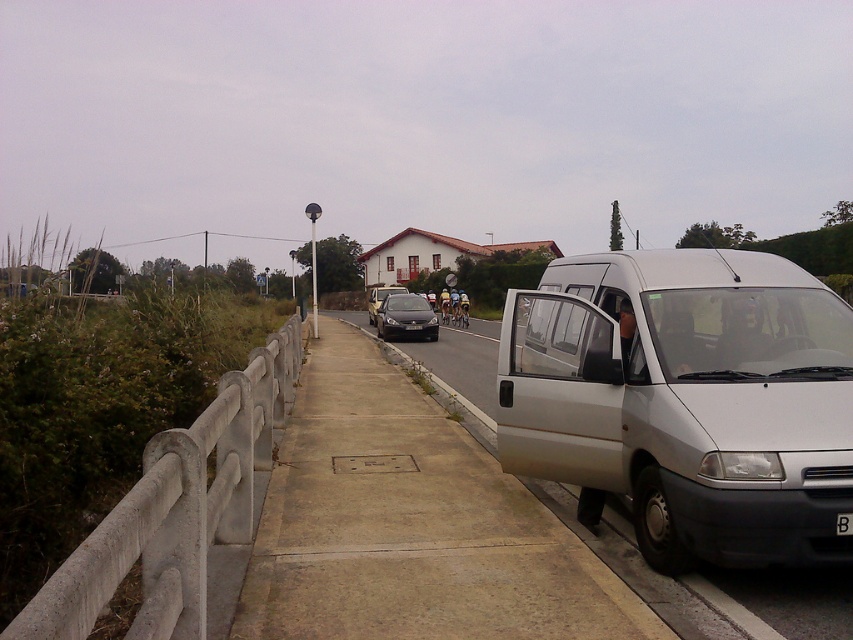
Question: Which point is farther from the camera taking this photo?

Choices:
 (A) [541, 348]
 (B) [380, 326]
 (C) [381, 307]
 (D) [849, 518]

Answer: (C)

Question: Does concrete at left lie behind satin black sedan at center?

Choices:
 (A) yes
 (B) no

Answer: (B)

Question: Is satin silver van at center wider than black plastic license plate at center?

Choices:
 (A) no
 (B) yes

Answer: (B)

Question: Can you confirm if white metallic van at right is positioned to the left of satin black sedan at center?

Choices:
 (A) no
 (B) yes

Answer: (A)

Question: Which object is farther from the camera taking this photo?

Choices:
 (A) concrete at left
 (B) satin silver van at center
 (C) white metallic van at right
 (D) black plastic license plate at center

Answer: (B)

Question: Which point is closer to the camera?

Choices:
 (A) (381, 336)
 (B) (753, 316)
 (C) (161, 554)

Answer: (C)